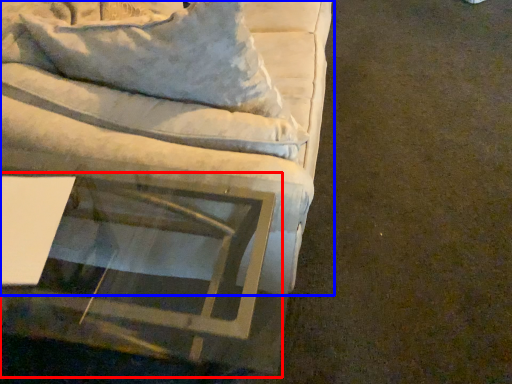
Question: Which object appears closest to the camera in this image, round table (highlighted by a red box) or studio couch (highlighted by a blue box)?

Choices:
 (A) round table
 (B) studio couch

Answer: (A)